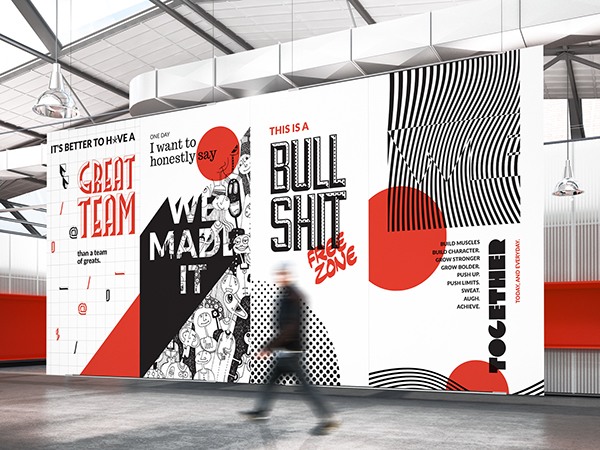
This screenshot has width=600, height=450. I want to click on grey floor, so click(x=149, y=411).